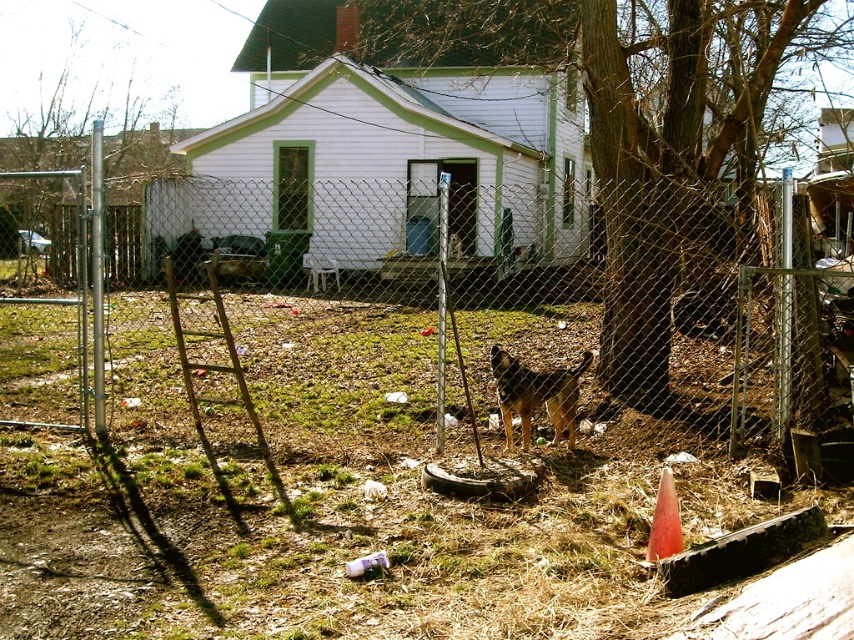
Is metal chain-link fence at center above brown fur dog at center?

Correct, metal chain-link fence at center is located above brown fur dog at center.

Consider the image. Between metal chain-link fence at center and brown fur dog at center, which one appears on the left side from the viewer's perspective?

From the viewer's perspective, metal chain-link fence at center appears more on the left side.

What do you see at coordinates (433, 301) in the screenshot? The height and width of the screenshot is (640, 854). I see `metal chain-link fence at center` at bounding box center [433, 301].

The image size is (854, 640). Find the location of `metal chain-link fence at center`. metal chain-link fence at center is located at coordinates (433, 301).

Does brown fur dog at center have a lesser height compared to orange matte cone at lower right?

No, brown fur dog at center is not shorter than orange matte cone at lower right.

Which of these two, brown fur dog at center or orange matte cone at lower right, stands shorter?

Standing shorter between the two is orange matte cone at lower right.

Between point (572, 396) and point (673, 499), which one is positioned in front?

Positioned in front is point (673, 499).

Locate an element on the screen. brown fur dog at center is located at coordinates (535, 394).

Can you confirm if metal chain-link fence at center is taller than orange matte cone at lower right?

Yes.

Is point (600, 328) in front of point (670, 547)?

No, (600, 328) is further to viewer.

This screenshot has height=640, width=854. I want to click on metal chain-link fence at center, so click(433, 301).